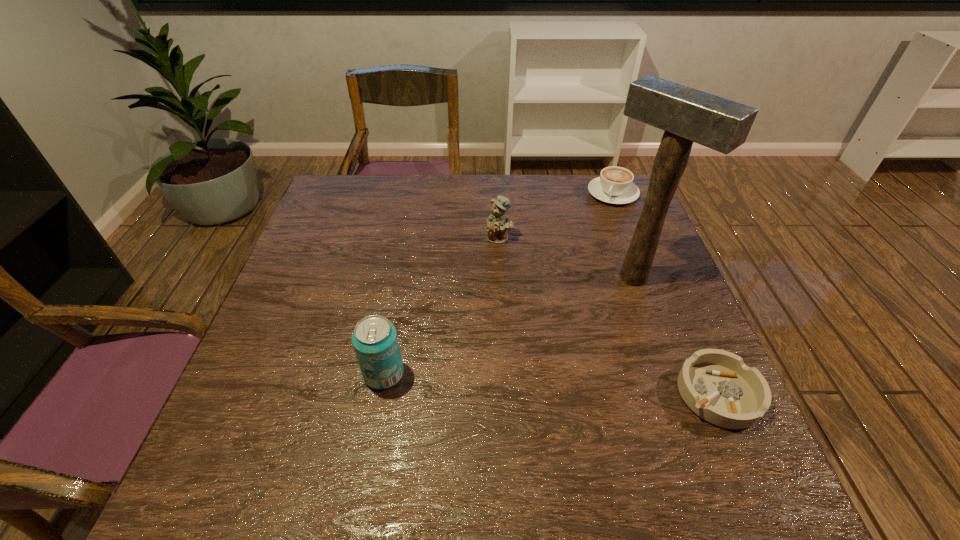
In the image, there is a desktop. Where is `vacant space at the far left corner`? The width and height of the screenshot is (960, 540). vacant space at the far left corner is located at coordinates (372, 193).

Locate an element on the screen. The height and width of the screenshot is (540, 960). empty space between the farthest object and the third nearest object is located at coordinates (623, 235).

This screenshot has height=540, width=960. Identify the location of free spot between the shortest object and the teddy bear. (609, 316).

In order to click on free space between the farthest object and the leftmost object in this screenshot , I will do `click(498, 284)`.

Where is `vacant space in between the leftmost object and the shortest object`? Image resolution: width=960 pixels, height=540 pixels. vacant space in between the leftmost object and the shortest object is located at coordinates coord(551,384).

Image resolution: width=960 pixels, height=540 pixels. Find the location of `empty location between the tallest object and the leftmost object`. empty location between the tallest object and the leftmost object is located at coordinates (509, 325).

Identify the location of empty space that is in between the ashtray and the leftmost object. (551, 384).

Find the location of a particular element. free space between the mallet and the farthest object is located at coordinates (623, 235).

This screenshot has width=960, height=540. In order to click on vacant space that's between the fourth tallest object and the leftmost object in this screenshot , I will do `click(498, 284)`.

Locate an element on the screen. empty space that is in between the ashtray and the second farthest object is located at coordinates (609, 316).